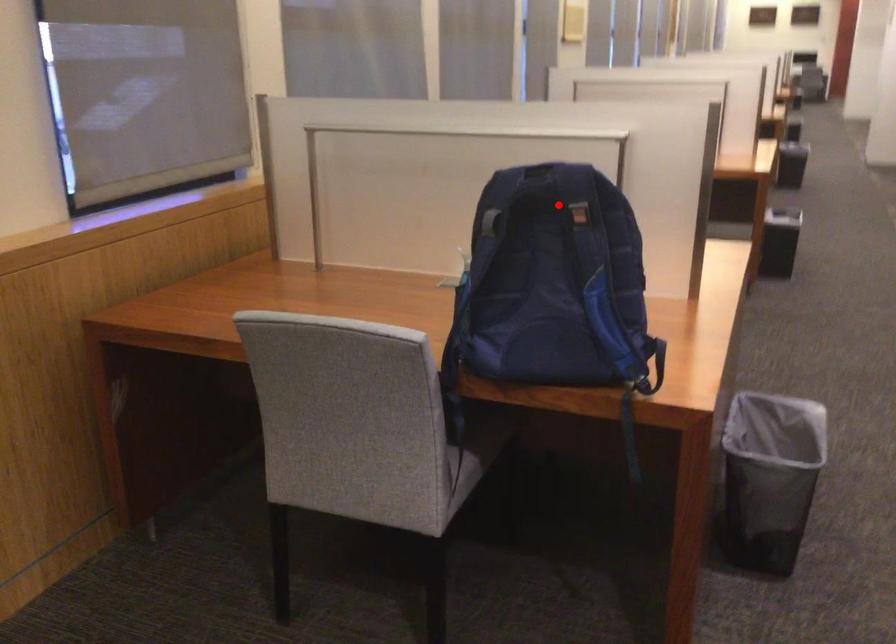
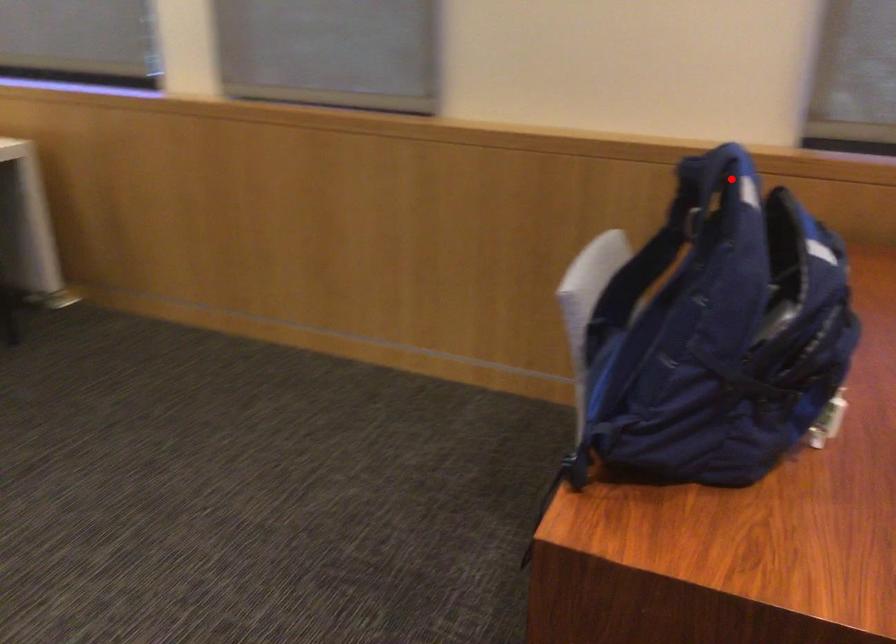
I am providing you with two images of the same scene from different viewpoints. A red point is marked on the first image and another point is marked on the second image. Is the marked point in image1 the same physical position as the marked point in image2?

No